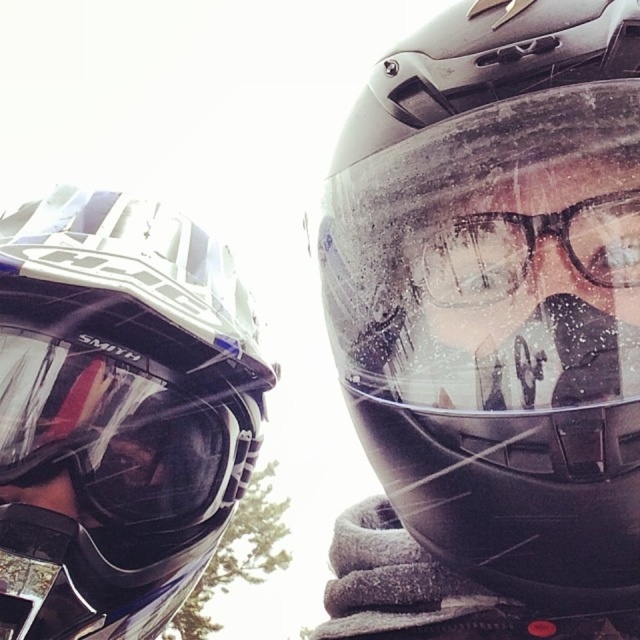
Locate an element on the screen. matte black helmet at center is located at coordinates (499, 292).

Can you confirm if matte black helmet at center is thinner than matte black helmet at upper left?

Indeed, matte black helmet at center has a lesser width compared to matte black helmet at upper left.

Who is more forward, (477,538) or (116,342)?

Point (477,538)

Where is `matte black helmet at center`? This screenshot has width=640, height=640. matte black helmet at center is located at coordinates (499, 292).

Does matte black helmet at center have a greater height compared to transparent plastic glasses at center?

Yes.

Identify the location of matte black helmet at center. (499, 292).

Looking at this image, between matte black helmet at upper left and transparent plastic glasses at center, which one has more height?

matte black helmet at upper left is taller.

Consider the image. Can you confirm if matte black helmet at upper left is shorter than transparent plastic glasses at center?

No, matte black helmet at upper left is not shorter than transparent plastic glasses at center.

Between point (164, 561) and point (449, 296), which one is positioned in front?

Point (449, 296) is in front.

Where is `matte black helmet at upper left`? This screenshot has width=640, height=640. matte black helmet at upper left is located at coordinates (116, 412).